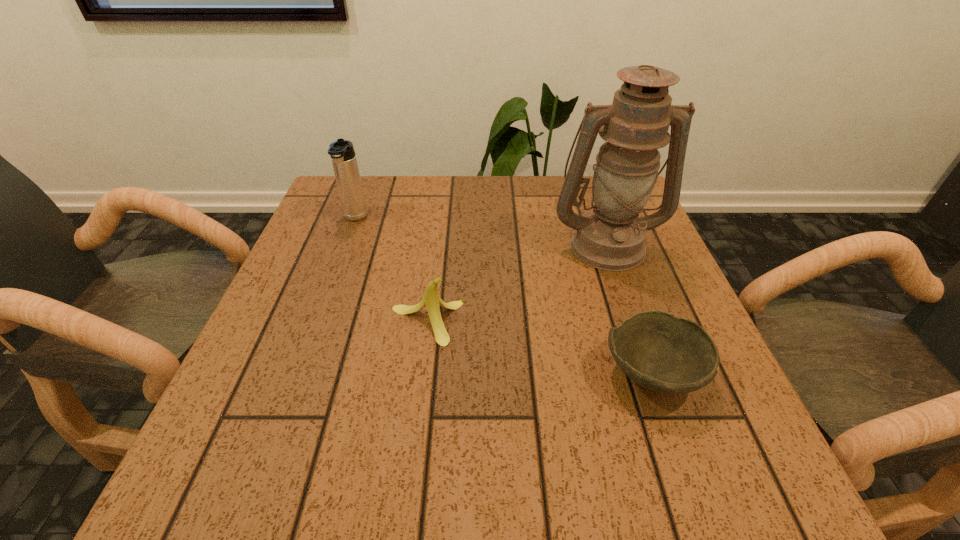
Image resolution: width=960 pixels, height=540 pixels. Find the location of `oil lamp`. oil lamp is located at coordinates (610, 237).

The image size is (960, 540). Find the location of `thermos bottle`. thermos bottle is located at coordinates (344, 161).

Identify the location of the leftmost object. The image size is (960, 540). (344, 161).

At what (x,y) coordinates should I click in order to perform the action: click on the second object from left to right. Please return your answer as a coordinate pair (x, y). Looking at the image, I should click on (431, 300).

This screenshot has width=960, height=540. I want to click on banana, so click(431, 300).

Identify the location of the shortest object. (659, 351).

Identify the location of vacant space located 0.360m on the front of the oil lamp. (667, 420).

Locate an element on the screen. vacant space located on the handle side of the thermos bottle is located at coordinates (338, 266).

This screenshot has height=540, width=960. I want to click on vacant space located on the front of the third tallest object, so click(x=415, y=433).

Identify the location of vacant space positioned on the left of the shortest object. This screenshot has width=960, height=540. (431, 373).